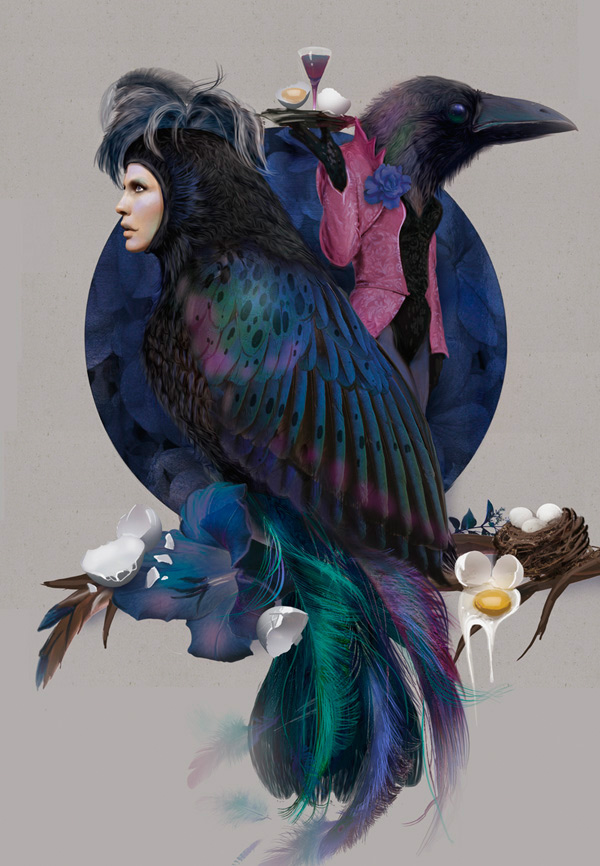
You are a GUI agent. You are given a task and a screenshot of the screen. Output one action in this format:
    pyautogui.click(x=<x>, y=<y>)
    Task: Click on the glass of wine
    
    Given the screenshot: What is the action you would take?
    pyautogui.click(x=318, y=66)